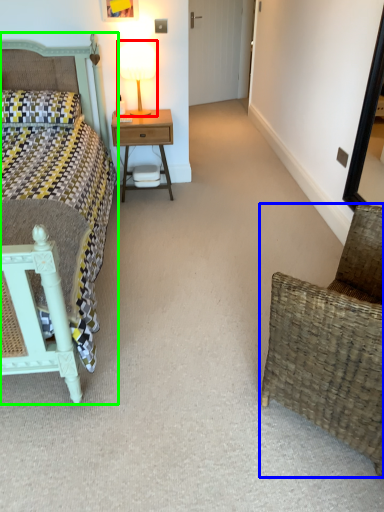
Question: Estimate the real-world distances between objects in this image. Which object is closer to bedside lamp (highlighted by a red box), chair (highlighted by a blue box) or bed (highlighted by a green box)?

Choices:
 (A) chair
 (B) bed

Answer: (B)